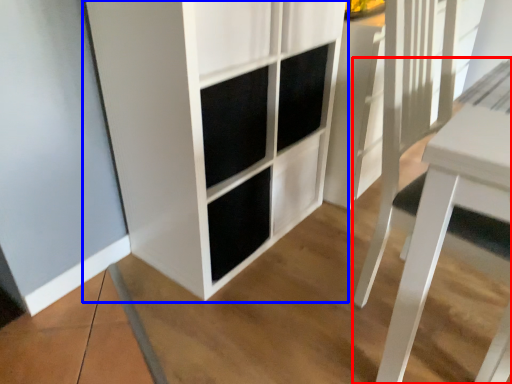
Question: Which point is further to the camera, table (highlighted by a red box) or cupboard (highlighted by a blue box)?

Choices:
 (A) table
 (B) cupboard

Answer: (B)